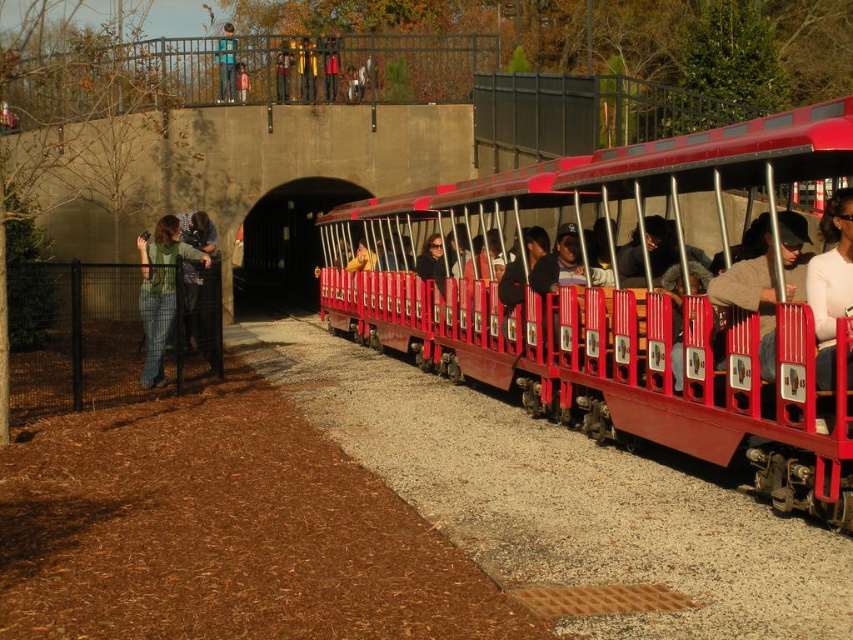
Which is in front, point (643, 390) or point (146, 330)?

Point (643, 390) is in front.

Is metallic red train at right to the right of green sweater at left from the viewer's perspective?

Correct, you'll find metallic red train at right to the right of green sweater at left.

The width and height of the screenshot is (853, 640). Find the location of `metallic red train at right`. metallic red train at right is located at coordinates (631, 296).

In order to click on metallic red train at right in this screenshot , I will do `click(631, 296)`.